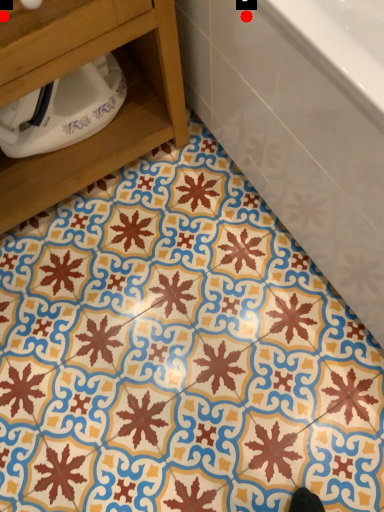
Question: Two points are circled on the image, labeled by A and B beside each circle. Which point is closer to the camera taking this photo?

Choices:
 (A) A is closer
 (B) B is closer

Answer: (A)